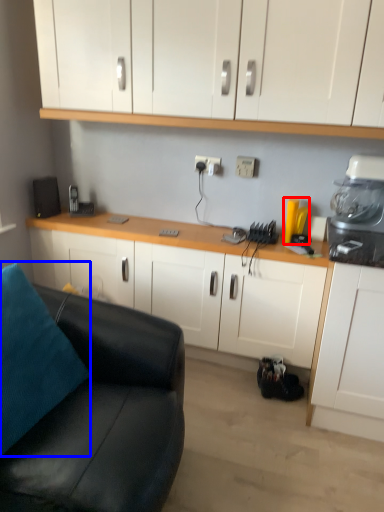
Question: Among these objects, which one is nearest to the camera, appliance (highlighted by a red box) or pillow (highlighted by a blue box)?

Choices:
 (A) appliance
 (B) pillow

Answer: (B)